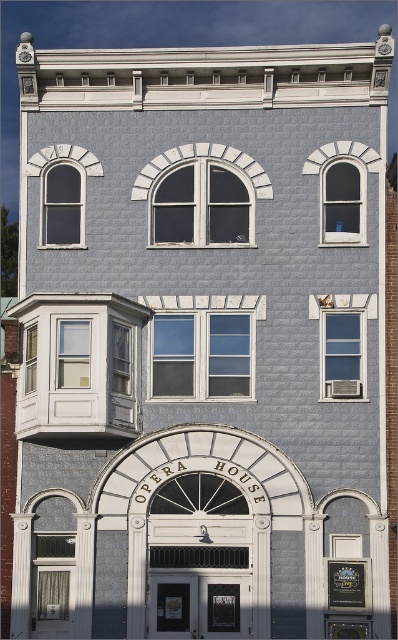
Between matte glass window at center and matte glass window at left, which one has more height?

matte glass window at center

From the picture: Which is more to the left, matte glass window at center or matte glass window at left?

matte glass window at left

This screenshot has height=640, width=398. Describe the element at coordinates (200, 205) in the screenshot. I see `matte glass window at center` at that location.

You are a GUI agent. You are given a task and a screenshot of the screen. Output one action in this format:
    pyautogui.click(x=<x>, y=<y>)
    Task: Click on the matte glass window at center
    
    Given the screenshot: What is the action you would take?
    pyautogui.click(x=200, y=205)

Can you confirm if clear glass window at center is bigger than clear glass window at upper right?

Actually, clear glass window at center might be smaller than clear glass window at upper right.

Does clear glass window at center have a smaller size compared to clear glass window at upper right?

Correct, clear glass window at center occupies less space than clear glass window at upper right.

What do you see at coordinates (202, 344) in the screenshot?
I see `clear glass window at center` at bounding box center [202, 344].

At what (x,y) coordinates should I click in order to perform the action: click on clear glass window at center. Please return your answer as a coordinate pair (x, y). The height and width of the screenshot is (640, 398). Looking at the image, I should click on (202, 344).

Where is `clear glass window at upper right`? This screenshot has height=640, width=398. clear glass window at upper right is located at coordinates (343, 188).

Which is in front, point (335, 195) or point (351, 312)?

Point (351, 312)

Find the location of a particular element. Image resolution: width=398 pixels, height=640 pixels. clear glass window at upper right is located at coordinates click(343, 188).